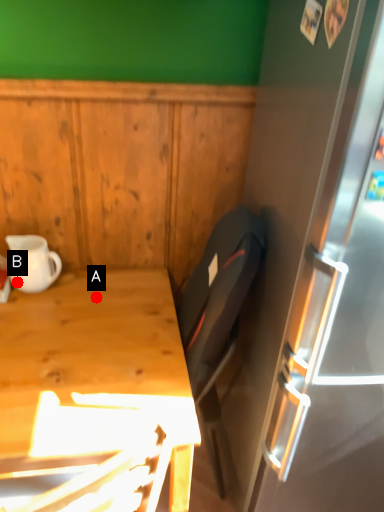
Question: Two points are circled on the image, labeled by A and B beside each circle. Among these points, which one is nearest to the camera?

Choices:
 (A) A is closer
 (B) B is closer

Answer: (A)